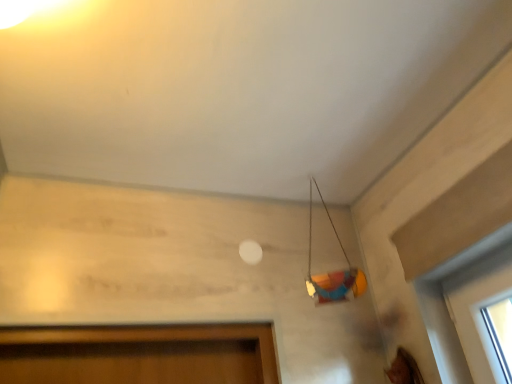
Question: Should I look upward or downward to see multicolored plastic toy at upper right?

Choices:
 (A) up
 (B) down

Answer: (B)